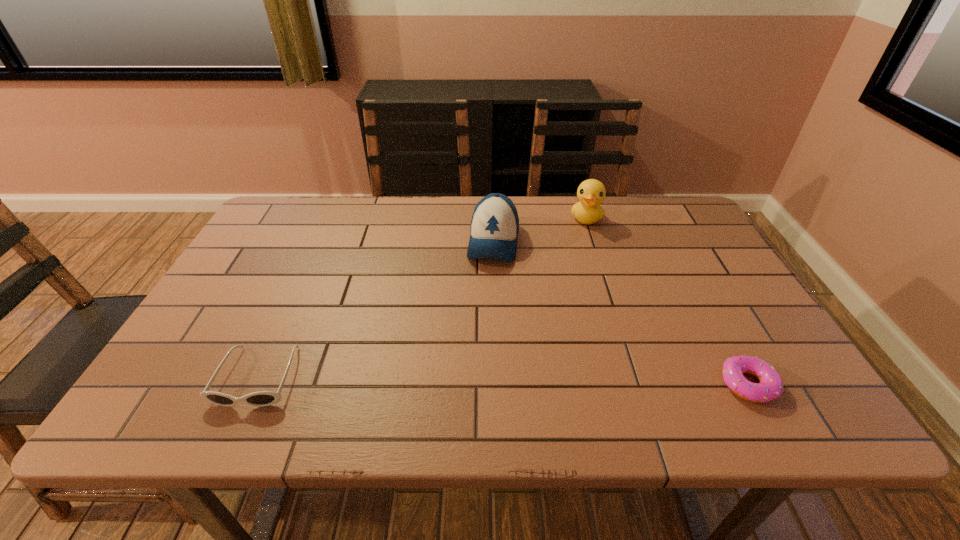
The width and height of the screenshot is (960, 540). What are the coordinates of `vacant point located between the rightmost object and the third object from right to left` in the screenshot? It's located at (621, 313).

Find the location of `empty location between the duck and the second object from left to right`. empty location between the duck and the second object from left to right is located at coordinates (540, 230).

Locate an element on the screen. unoccupied position between the leftmost object and the third object from left to right is located at coordinates (422, 298).

This screenshot has height=540, width=960. What are the coordinates of `empty space between the second object from right to left and the rightmost object` in the screenshot? It's located at (667, 301).

This screenshot has height=540, width=960. What are the coordinates of `free space that is in between the rightmost object and the second shortest object` in the screenshot? It's located at (503, 381).

Locate an element on the screen. Image resolution: width=960 pixels, height=540 pixels. blank region between the duck and the sunglasses is located at coordinates (422, 298).

The image size is (960, 540). I want to click on free point between the rightmost object and the duck, so click(x=667, y=301).

Image resolution: width=960 pixels, height=540 pixels. I want to click on object that stands as the second closest to the duck, so click(x=771, y=386).

Locate an element on the screen. Image resolution: width=960 pixels, height=540 pixels. object that stands as the third closest to the rightmost object is located at coordinates (262, 398).

Locate an element on the screen. free space that satisfies the following two spatial constraints: 1. with the lenses of the sunglasses facing outward; 2. on the left side of the shortest object is located at coordinates (254, 384).